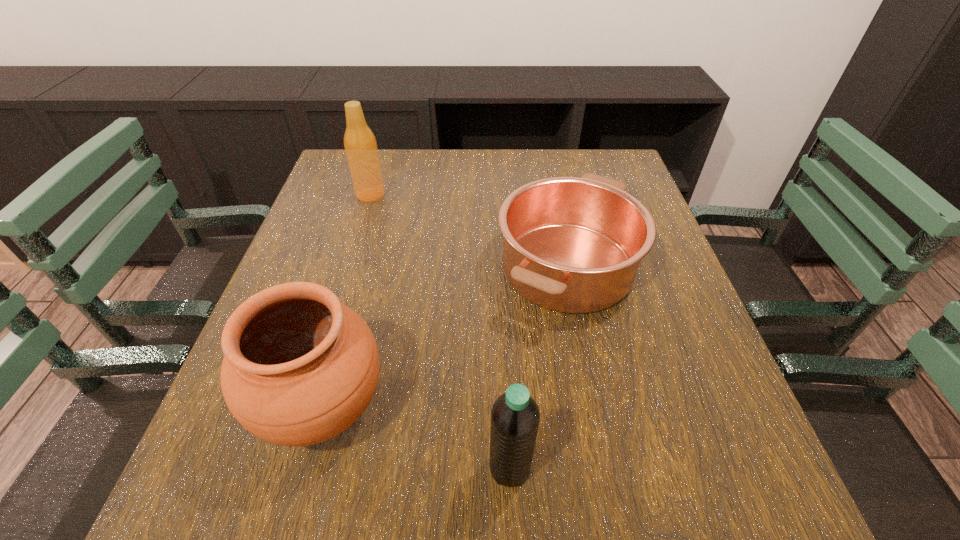
Locate an element on the screen. empty space that is in between the water bottle and the saucepan is located at coordinates (539, 367).

Locate an element on the screen. free point between the pottery and the water bottle is located at coordinates (417, 437).

This screenshot has width=960, height=540. Identify the location of free spot between the water bottle and the beer bottle. (440, 331).

The width and height of the screenshot is (960, 540). I want to click on object that is the second closest to the farthest object, so click(299, 367).

The width and height of the screenshot is (960, 540). I want to click on the second closest object relative to the saucepan, so click(x=515, y=416).

Image resolution: width=960 pixels, height=540 pixels. In order to click on free region that satisfies the following two spatial constraints: 1. on the back side of the shortest object; 2. on the left side of the pottery in this screenshot , I will do `click(362, 266)`.

Locate an element on the screen. vacant space that satisfies the following two spatial constraints: 1. on the back side of the pottery; 2. on the left side of the saucepan is located at coordinates (362, 266).